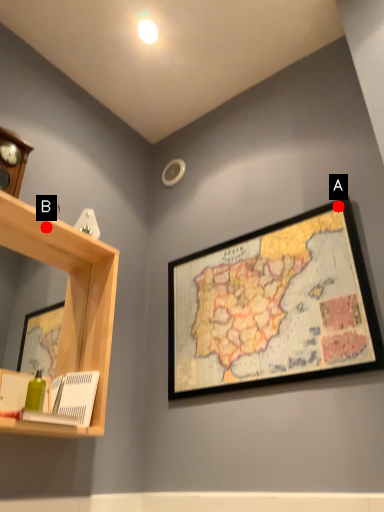
Question: Two points are circled on the image, labeled by A and B beside each circle. Which point is farther to the camera?

Choices:
 (A) A is further
 (B) B is further

Answer: (A)